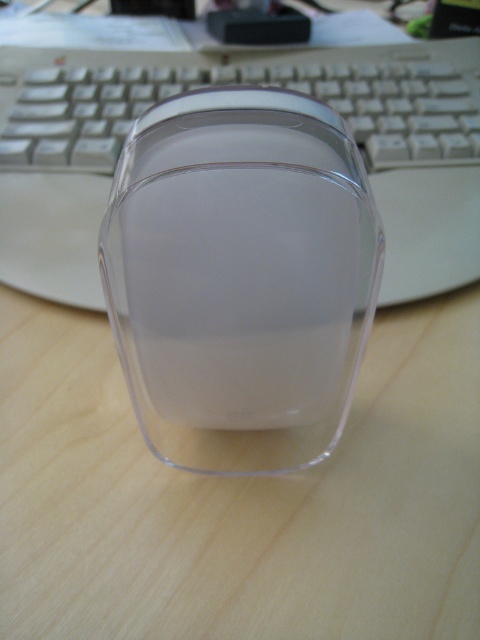
Based on the photo, you need to place both the transparent plastic mouse at center and the white plastic keyboard at center into a storage box. The box has a height limit of 5 cm. Which object might not fit if placed vertically?

The white plastic keyboard at center might not fit into the storage box if placed vertically because the transparent plastic mouse at center is thinner than it, implying the keyboard is thicker and could exceed the 5 cm height limit.

In the scene shown: You are organizing your desk and want to place the transparent plastic mouse at center and the white plastic keyboard at center in a straight line. If you want the mouse to be on the left side, is the current arrangement correct?

Yes, the current arrangement is correct because the transparent plastic mouse at center is positioned on the left side of the white plastic keyboard at center.